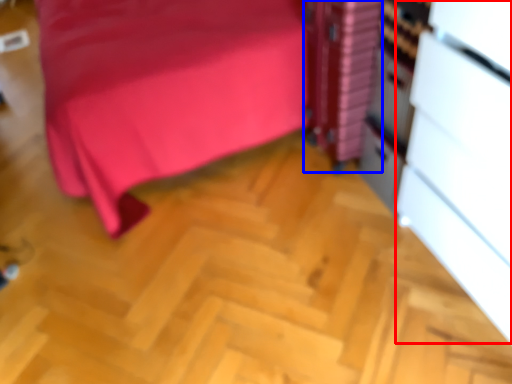
Question: Which point is further to the camera, file cabinet (highlighted by a red box) or file cabinet (highlighted by a blue box)?

Choices:
 (A) file cabinet
 (B) file cabinet

Answer: (B)